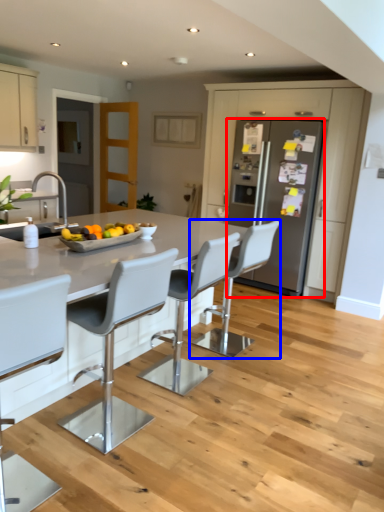
Question: Among these objects, which one is nearest to the camera, refrigerator (highlighted by a red box) or chair (highlighted by a blue box)?

Choices:
 (A) refrigerator
 (B) chair

Answer: (B)